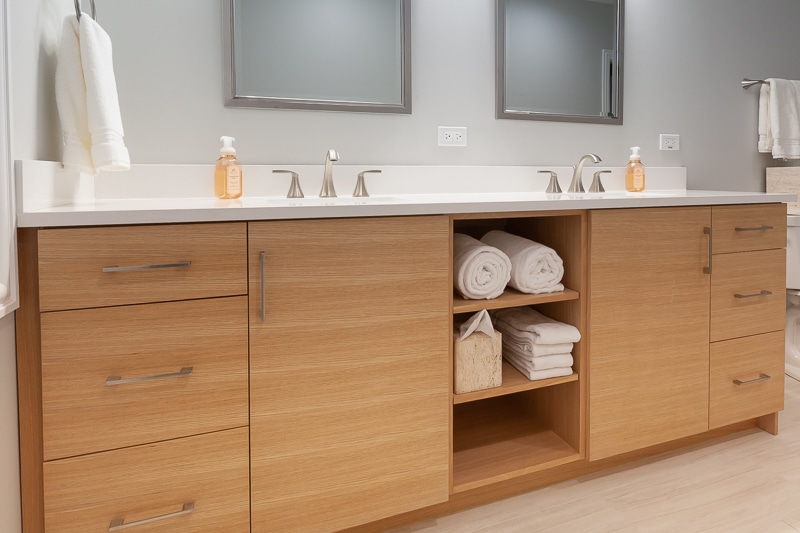
Image resolution: width=800 pixels, height=533 pixels. In order to click on stored cloths in this screenshot , I will do `click(562, 336)`, `click(550, 351)`, `click(548, 360)`, `click(545, 374)`.